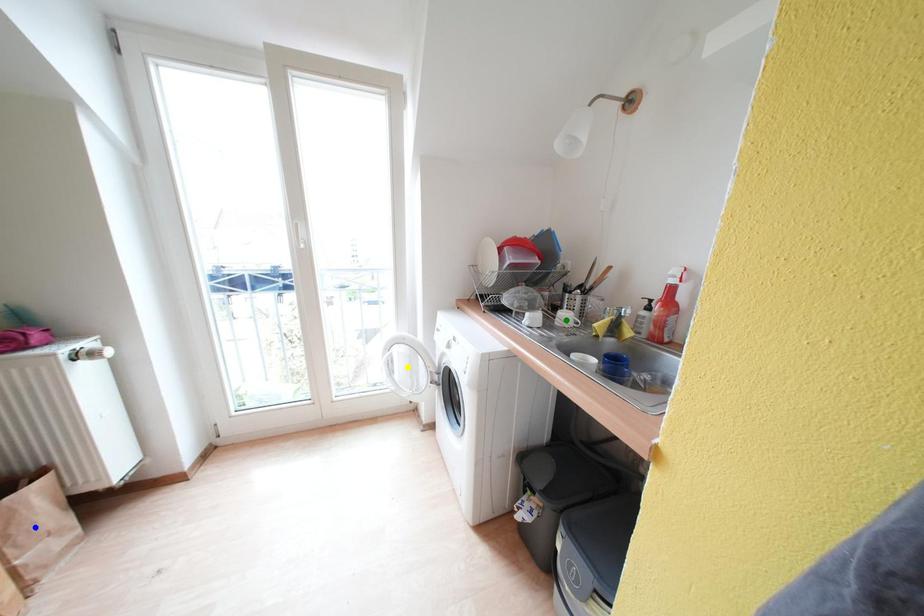
Order these from nearest to farthest:
green point, yellow point, blue point

blue point, green point, yellow point